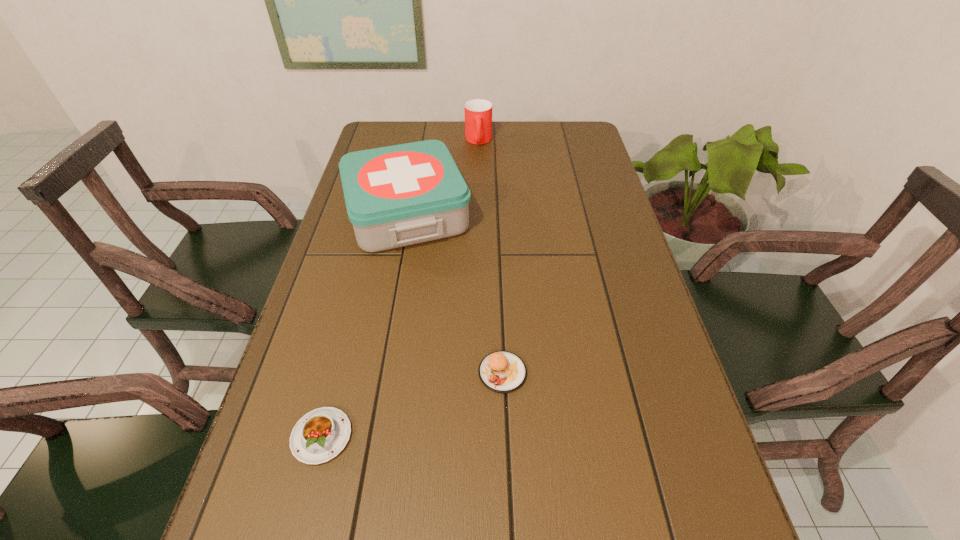
The height and width of the screenshot is (540, 960). What are the coordinates of `vacant space that satisfies the following two spatial constraints: 1. on the side of the cup with the handle; 2. on the right side of the third farthest object` in the screenshot? It's located at (477, 373).

Identify the location of vacant space that satisfies the following two spatial constraints: 1. on the back side of the second nearest object; 2. on the right side of the pudding. The image size is (960, 540). (338, 373).

This screenshot has height=540, width=960. What are the coordinates of `vacant area in the image that satisfies the following two spatial constraints: 1. on the back side of the nearest object; 2. on the left side of the patty` in the screenshot? It's located at (338, 373).

I want to click on free spot that satisfies the following two spatial constraints: 1. on the back side of the shortest object; 2. on the right side of the second farthest object, so click(379, 213).

I want to click on free spot that satisfies the following two spatial constraints: 1. on the back side of the third nearest object; 2. on the left side of the pudding, so click(379, 213).